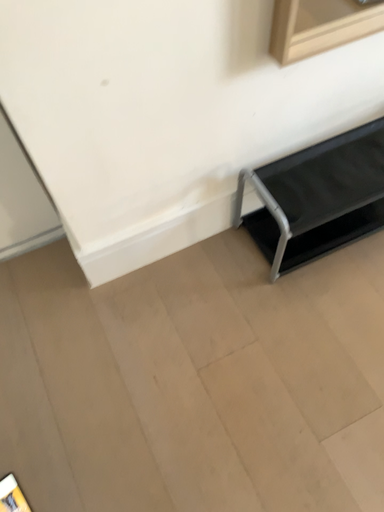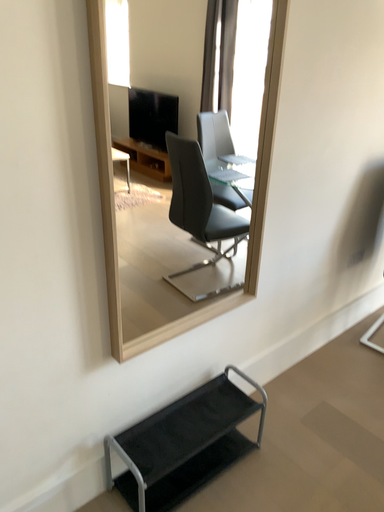
Question: How did the camera likely rotate when shooting the video?

Choices:
 (A) rotated right
 (B) rotated left

Answer: (A)